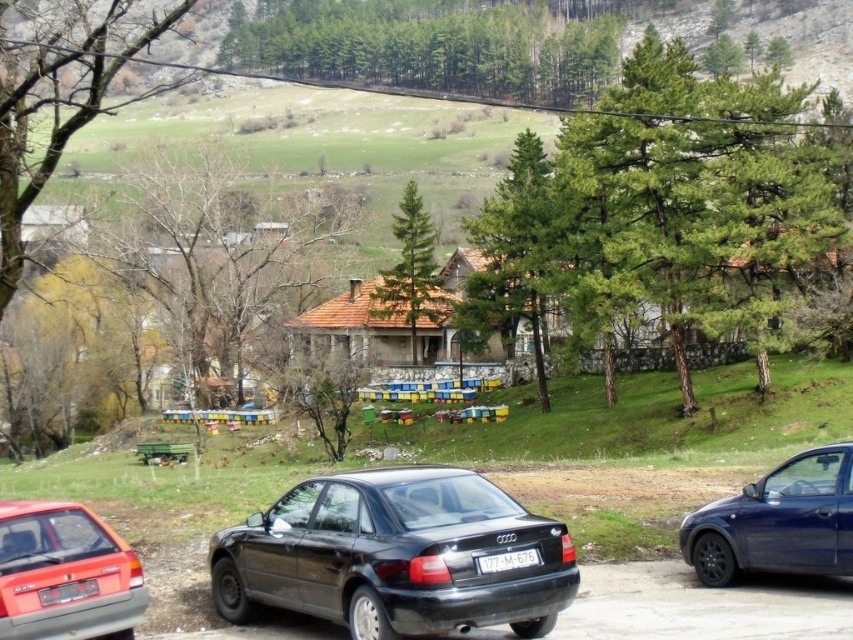
Question: Among these points, which one is farthest from the camera?

Choices:
 (A) (444, 604)
 (B) (105, 612)
 (C) (801, 522)

Answer: (C)

Question: Which object is positioned closest to the glossy blue sedan at right?

Choices:
 (A) black glossy sedan at center
 (B) matte red sedan at lower left
 (C) white plastic license plate at center

Answer: (C)

Question: Where is matte red sedan at lower left located in relation to white plastic license plate at center in the image?

Choices:
 (A) below
 (B) above

Answer: (A)

Question: Is glossy blue sedan at right behind white plastic license plate at center?

Choices:
 (A) yes
 (B) no

Answer: (A)

Question: Is matte red sedan at lower left wider than glossy blue sedan at right?

Choices:
 (A) yes
 (B) no

Answer: (B)

Question: Which is nearer to the black glossy sedan at center?

Choices:
 (A) white plastic license plate at center
 (B) glossy blue sedan at right
 (C) matte red sedan at lower left

Answer: (A)